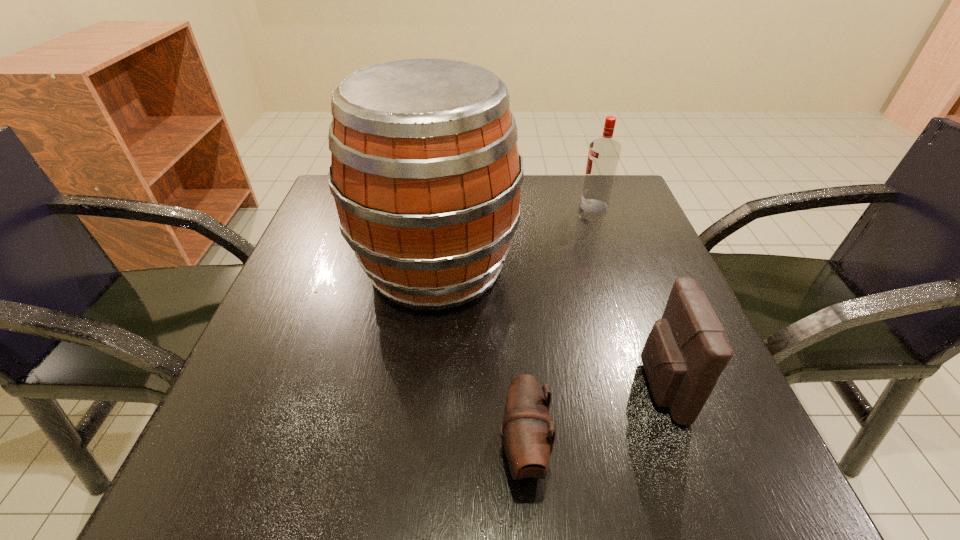
Locate an element on the screen. Image resolution: width=960 pixels, height=540 pixels. blank area located on the front label of the third shortest object is located at coordinates (452, 206).

Find the location of a particular element. The height and width of the screenshot is (540, 960). vacant position located on the front label of the third shortest object is located at coordinates (491, 206).

What are the coordinates of `vacant point located with an open flap on the right pouch` in the screenshot? It's located at [x=504, y=387].

This screenshot has height=540, width=960. What are the coordinates of `free space located 0.080m with an open flap on the right pouch` in the screenshot? It's located at (589, 387).

The height and width of the screenshot is (540, 960). What are the coordinates of `free point located with an open flap on the right pouch` in the screenshot? It's located at (596, 387).

Where is `free region located with the flap open on the shorter pouch`? The width and height of the screenshot is (960, 540). free region located with the flap open on the shorter pouch is located at coordinates (270, 451).

Identify the location of free region located with the flap open on the shorter pouch. (447, 451).

Image resolution: width=960 pixels, height=540 pixels. What are the coordinates of `free space located 0.220m with the flap open on the shorter pouch` in the screenshot? It's located at coord(337,451).

Image resolution: width=960 pixels, height=540 pixels. What are the coordinates of `cider at the far edge` in the screenshot? It's located at (425, 171).

Where is `vodka situated at the far edge`? The image size is (960, 540). vodka situated at the far edge is located at coordinates (603, 156).